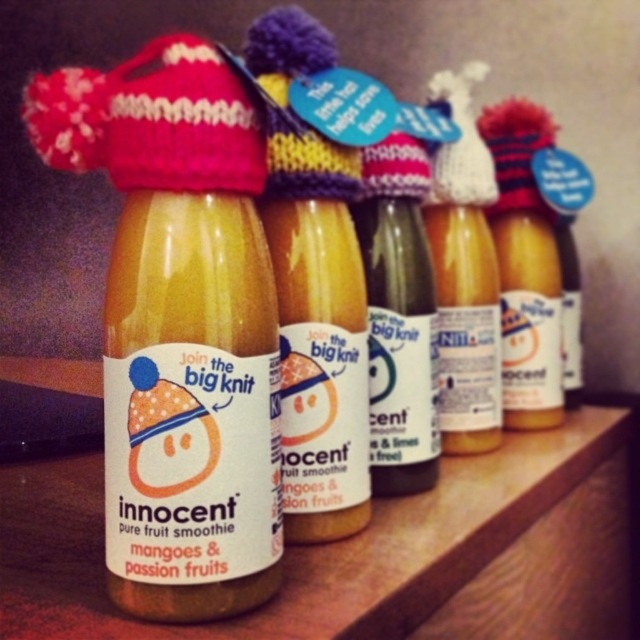
Question: Can you confirm if translucent glass bottle at center is positioned to the right of matte glass bottle at center?

Choices:
 (A) yes
 (B) no

Answer: (B)

Question: Observing the image, what is the correct spatial positioning of translucent glass bottle at center in reference to matte glass bottle at center?

Choices:
 (A) above
 (B) below

Answer: (B)

Question: Which point appears farthest from the camera in this image?

Choices:
 (A) (419, 145)
 (B) (237, 209)

Answer: (A)

Question: Which object appears closest to the camera in this image?

Choices:
 (A) translucent glass bottle at center
 (B) matte glass bottle at center

Answer: (A)

Question: Does translucent glass bottle at center appear on the right side of matte glass bottle at center?

Choices:
 (A) yes
 (B) no

Answer: (B)